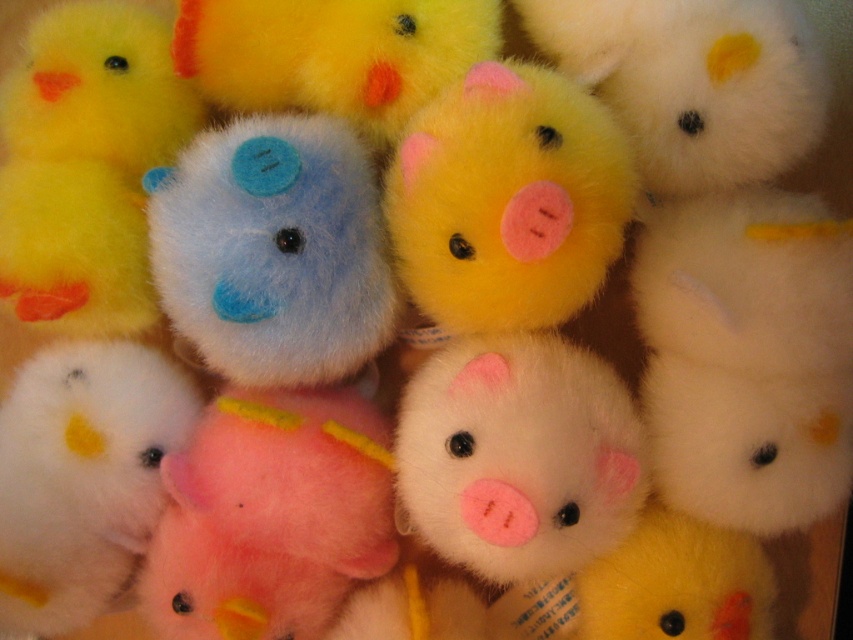
Question: Which of these objects is positioned closest to the yellow plush duck at center?

Choices:
 (A) yellow fuzzy pig at center
 (B) pink fluffy pig at center

Answer: (A)

Question: Where is yellow fuzzy pig at center located in relation to pink fluffy pig at center in the image?

Choices:
 (A) below
 (B) above

Answer: (B)

Question: Considering the real-world distances, which object is farthest from the yellow plush duck at center?

Choices:
 (A) yellow fuzzy pig at center
 (B) fluffy blue bear at center
 (C) pink fluffy pig at center

Answer: (C)

Question: Does pink fluffy pig at center have a smaller size compared to yellow plush duck at center?

Choices:
 (A) yes
 (B) no

Answer: (B)

Question: Is fluffy blue bear at center bigger than yellow fuzzy pig at center?

Choices:
 (A) yes
 (B) no

Answer: (B)

Question: Which object is positioned farthest from the fluffy blue bear at center?

Choices:
 (A) yellow plush duck at center
 (B) yellow fuzzy pig at center
 (C) pink fluffy pig at center

Answer: (A)